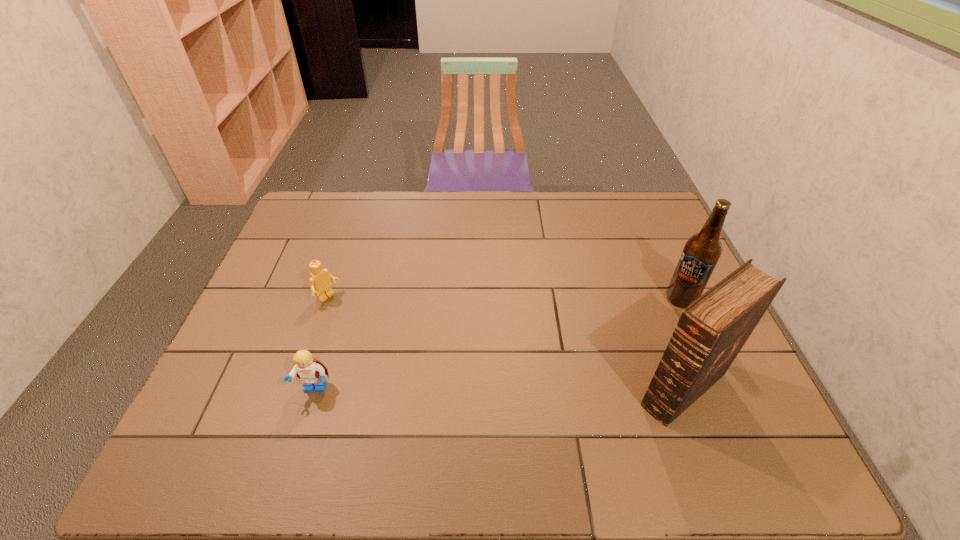
In order to click on free space located 0.210m on the face of the farther Lego in this screenshot , I will do `click(386, 343)`.

Image resolution: width=960 pixels, height=540 pixels. What are the coordinates of `Lego that is at the near edge` in the screenshot? It's located at (310, 371).

You are a GUI agent. You are given a task and a screenshot of the screen. Output one action in this format:
    pyautogui.click(x=<x>, y=<y>)
    Task: Click on the Bible situated at the near edge
    Image resolution: width=960 pixels, height=540 pixels.
    Given the screenshot: What is the action you would take?
    pyautogui.click(x=711, y=331)

Identify the location of Bible that is at the right edge. (711, 331).

The width and height of the screenshot is (960, 540). Find the location of `beer bottle at the right edge`. beer bottle at the right edge is located at coordinates (702, 251).

Locate an element on the screen. The height and width of the screenshot is (540, 960). object present at the near right corner is located at coordinates (711, 331).

In order to click on free space at the far edge of the desktop in this screenshot , I will do `click(396, 205)`.

Find the location of `free spot at the near edge of the desktop`. free spot at the near edge of the desktop is located at coordinates (348, 397).

In the image, there is a desktop. Identify the location of vacant space at the left edge. (296, 264).

Where is `free spot at the right edge of the desktop`? This screenshot has width=960, height=540. free spot at the right edge of the desktop is located at coordinates (651, 241).